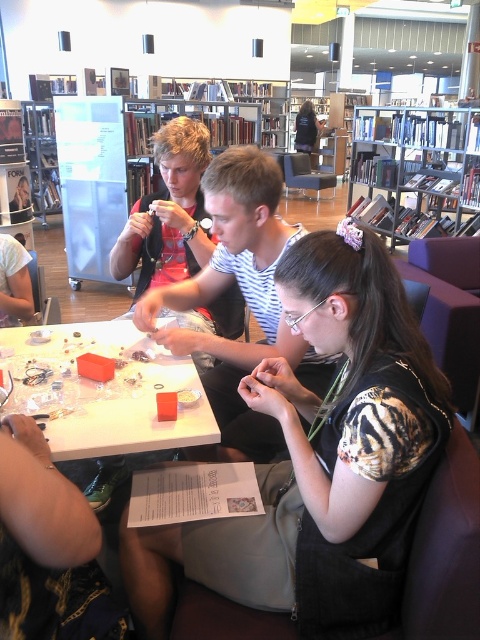
You are standing in the library and want to take a photo of the point at coordinates (441,416). The camera you are using has a minimum focus distance of 35 inches. Will the camera be able to focus on the point?

The point at coordinates (441,416) is 36.03 inches from the camera. Since the minimum focus distance is 35 inches, the camera can focus on the point as it is slightly beyond the minimum required distance.